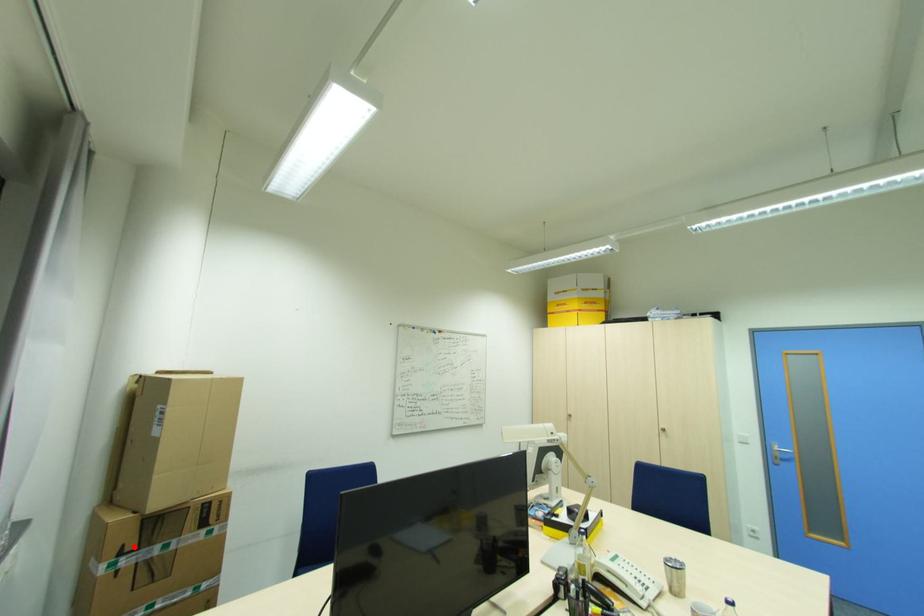
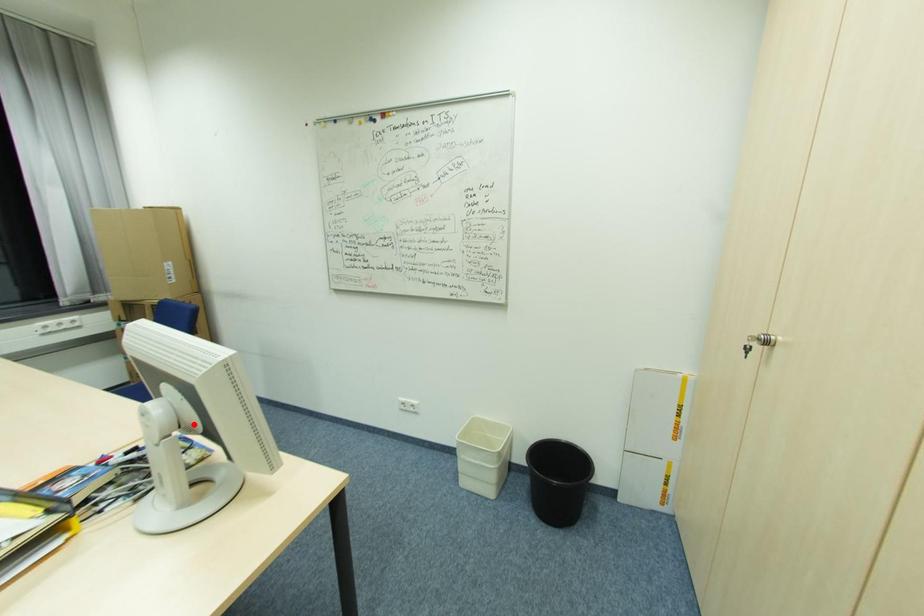
I am providing you with two images of the same scene from different viewpoints. A red point is marked on the first image and another point is marked on the second image. Are the points marked in image1 and image2 representing the same 3D position?

No